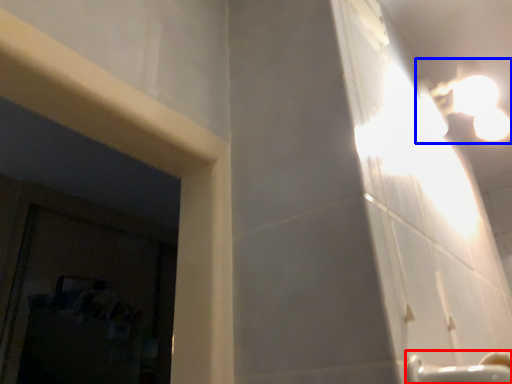
Question: Which object is further to the camera taking this photo, faucet (highlighted by a red box) or light fixture (highlighted by a blue box)?

Choices:
 (A) faucet
 (B) light fixture

Answer: (B)